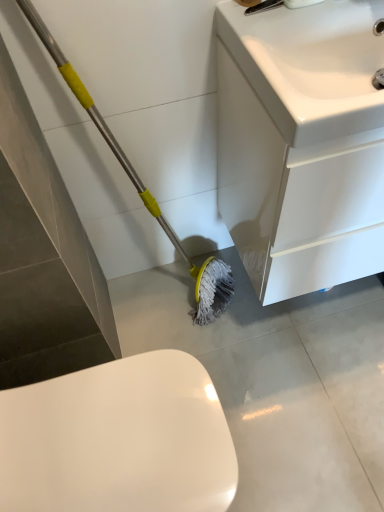
Question: Can you confirm if white glossy cabinet at lower right is positioned to the right of white glossy toilet at lower left?

Choices:
 (A) no
 (B) yes

Answer: (B)

Question: From a real-world perspective, is white glossy cabinet at lower right located beneath white glossy toilet at lower left?

Choices:
 (A) no
 (B) yes

Answer: (A)

Question: Is white glossy cabinet at lower right at the left side of white glossy toilet at lower left?

Choices:
 (A) no
 (B) yes

Answer: (A)

Question: Considering the relative positions of white glossy cabinet at lower right and white glossy toilet at lower left in the image provided, is white glossy cabinet at lower right in front of white glossy toilet at lower left?

Choices:
 (A) yes
 (B) no

Answer: (B)

Question: Is white glossy cabinet at lower right oriented towards white glossy toilet at lower left?

Choices:
 (A) no
 (B) yes

Answer: (A)

Question: From the image's perspective, relative to white glossy sink at upper right, is white glossy cabinet at lower right above or below?

Choices:
 (A) below
 (B) above

Answer: (A)

Question: Based on their sizes in the image, would you say white glossy cabinet at lower right is bigger or smaller than white glossy sink at upper right?

Choices:
 (A) big
 (B) small

Answer: (A)

Question: Which is correct: white glossy cabinet at lower right is inside white glossy sink at upper right, or outside of it?

Choices:
 (A) outside
 (B) inside

Answer: (A)

Question: Is point click(x=276, y=96) closer or farther from the camera than point click(x=329, y=26)?

Choices:
 (A) farther
 (B) closer

Answer: (B)

Question: In terms of width, does white glossy sink at upper right look wider or thinner when compared to white glossy toilet at lower left?

Choices:
 (A) thin
 (B) wide

Answer: (A)

Question: From their relative heights in the image, would you say white glossy sink at upper right is taller or shorter than white glossy toilet at lower left?

Choices:
 (A) tall
 (B) short

Answer: (B)

Question: From a real-world perspective, is white glossy sink at upper right physically located above or below white glossy toilet at lower left?

Choices:
 (A) below
 (B) above

Answer: (B)

Question: Is white glossy sink at upper right inside or outside of white glossy toilet at lower left?

Choices:
 (A) inside
 (B) outside

Answer: (B)

Question: From the image's perspective, is white glossy toilet at lower left above or below white glossy cabinet at lower right?

Choices:
 (A) below
 (B) above

Answer: (A)

Question: Is point (0, 462) positioned closer to the camera than point (342, 31)?

Choices:
 (A) closer
 (B) farther

Answer: (A)